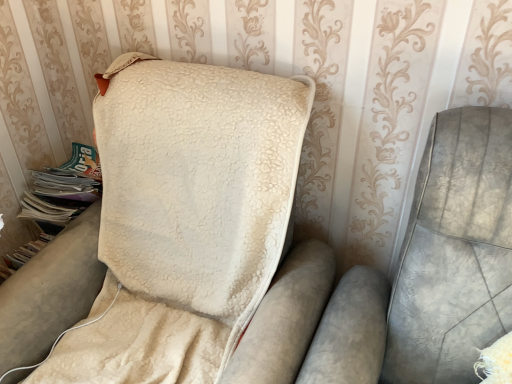
At what (x,y) coordinates should I click in order to perform the action: click on green paper magazine at left. Please return your answer as a coordinate pair (x, y). Image resolution: width=512 pixels, height=384 pixels. Looking at the image, I should click on (56, 201).

Measure the distance between point (38, 184) and camera.

They are 4.69 feet apart.

What do you see at coordinates (56, 201) in the screenshot? This screenshot has width=512, height=384. I see `green paper magazine at left` at bounding box center [56, 201].

What is the approximate height of green paper magazine at left?

green paper magazine at left is 7.37 inches in height.

What do you see at coordinates (194, 247) in the screenshot? Image resolution: width=512 pixels, height=384 pixels. I see `beige fleece blanket at center` at bounding box center [194, 247].

Where is `beige fleece blanket at center`? This screenshot has width=512, height=384. beige fleece blanket at center is located at coordinates (194, 247).

Identify the location of green paper magazine at left. (56, 201).

Does beige fleece blanket at center appear on the right side of green paper magazine at left?

Yes, beige fleece blanket at center is to the right of green paper magazine at left.

Considering the positions of objects beige fleece blanket at center and green paper magazine at left in the image provided, who is in front, beige fleece blanket at center or green paper magazine at left?

beige fleece blanket at center is more forward.

Is point (256, 120) closer or farther from the camera than point (71, 170)?

Point (256, 120) is positioned closer to the camera compared to point (71, 170).

From the image's perspective, which one is positioned higher, beige fleece blanket at center or green paper magazine at left?

green paper magazine at left, from the image's perspective.

From a real-world perspective, which is physically above, beige fleece blanket at center or green paper magazine at left?

From a 3D spatial view, green paper magazine at left is above.

Which object is thinner, beige fleece blanket at center or green paper magazine at left?

green paper magazine at left.

Does beige fleece blanket at center have a greater height compared to green paper magazine at left?

Yes, beige fleece blanket at center is taller than green paper magazine at left.

Considering the relative sizes of beige fleece blanket at center and green paper magazine at left in the image provided, is beige fleece blanket at center bigger than green paper magazine at left?

Correct, beige fleece blanket at center is larger in size than green paper magazine at left.

Can we say beige fleece blanket at center lies outside green paper magazine at left?

Yes, beige fleece blanket at center is located beyond the bounds of green paper magazine at left.

Does beige fleece blanket at center touch green paper magazine at left?

They are not placed beside each other.

Does beige fleece blanket at center turn towards green paper magazine at left?

No, beige fleece blanket at center is not turned towards green paper magazine at left.

You are a GUI agent. You are given a task and a screenshot of the screen. Output one action in this format:
    pyautogui.click(x=<x>, y=<y>)
    Task: Click on the magazine above the beige fleece blanket at center (from a real-world perspective)
    The height and width of the screenshot is (384, 512).
    Given the screenshot: What is the action you would take?
    pyautogui.click(x=56, y=201)

Considering the relative positions of green paper magazine at left and beige fleece blanket at center in the image provided, is green paper magazine at left to the left or to the right of beige fleece blanket at center?

Clearly, green paper magazine at left is on the left of beige fleece blanket at center in the image.

Based on the photo, does green paper magazine at left come in front of beige fleece blanket at center?

No, green paper magazine at left is further to the viewer.

Is point (45, 231) more distant than point (155, 339)?

Yes, point (45, 231) is farther from viewer.

From the image's perspective, which is below, green paper magazine at left or beige fleece blanket at center?

beige fleece blanket at center appears lower in the image.

From a real-world perspective, is green paper magazine at left positioned above or below beige fleece blanket at center?

From a real-world perspective, green paper magazine at left is physically above beige fleece blanket at center.

Can you confirm if green paper magazine at left is thinner than beige fleece blanket at center?

Yes.

From their relative heights in the image, would you say green paper magazine at left is taller or shorter than beige fleece blanket at center?

green paper magazine at left is shorter than beige fleece blanket at center.

Which of these two, green paper magazine at left or beige fleece blanket at center, is bigger?

beige fleece blanket at center.

Does green paper magazine at left contain beige fleece blanket at center?

→ No, beige fleece blanket at center is not a part of green paper magazine at left.

Is the surface of green paper magazine at left in direct contact with beige fleece blanket at center?

No, green paper magazine at left is not next to beige fleece blanket at center.

Does green paper magazine at left turn towards beige fleece blanket at center?

Yes, green paper magazine at left faces towards beige fleece blanket at center.

Measure the distance between green paper magazine at left and beige fleece blanket at center.

They are 15.13 inches apart.

Locate an element on the screen. magazine that appears above the beige fleece blanket at center (from a real-world perspective) is located at coordinates (56, 201).

Where is `furniture located underneath the green paper magazine at left (from a real-world perspective)`? The image size is (512, 384). furniture located underneath the green paper magazine at left (from a real-world perspective) is located at coordinates (194, 247).

Find the location of a particular element. Image resolution: width=512 pixels, height=384 pixels. magazine above the beige fleece blanket at center (from a real-world perspective) is located at coordinates 56,201.